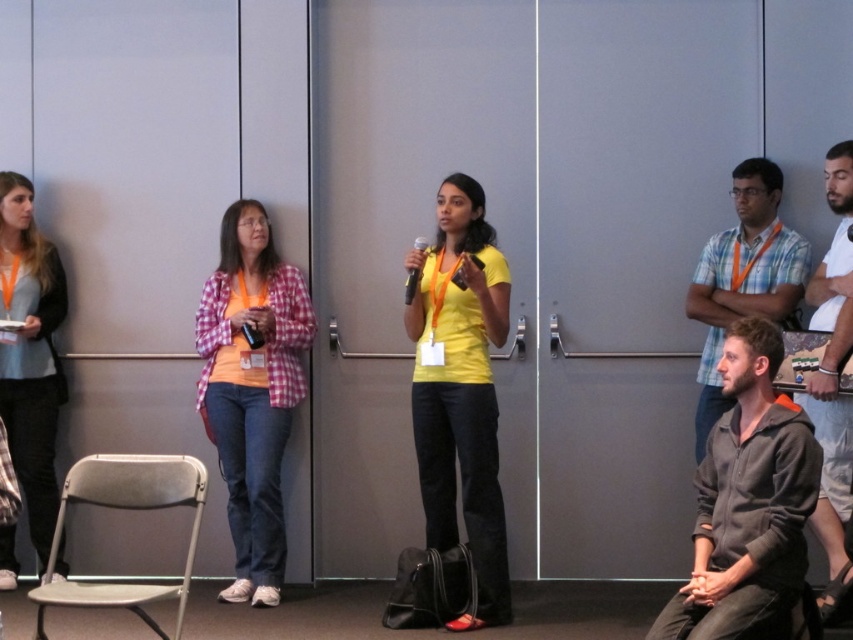
Question: Is gray fleece jacket at lower right positioned at the back of matte blue sweater at left?

Choices:
 (A) yes
 (B) no

Answer: (B)

Question: Is blue plaid shirt at right positioned before metallic gray folding chair at lower left?

Choices:
 (A) yes
 (B) no

Answer: (B)

Question: Does plaid shirt at center have a greater width compared to metallic gray folding chair at lower left?

Choices:
 (A) no
 (B) yes

Answer: (A)

Question: Which point appears closest to the camera in this image?

Choices:
 (A) (776, 440)
 (B) (1, 529)
 (C) (279, 518)

Answer: (A)

Question: Which is farther from the plaid shirt at center?

Choices:
 (A) beige cotton t-shirt at upper right
 (B) metallic gray folding chair at lower left
 (C) gray fleece jacket at lower right

Answer: (A)

Question: Which object is closer to the camera taking this photo?

Choices:
 (A) plaid shirt at center
 (B) blue plaid shirt at right
 (C) matte blue sweater at left

Answer: (B)